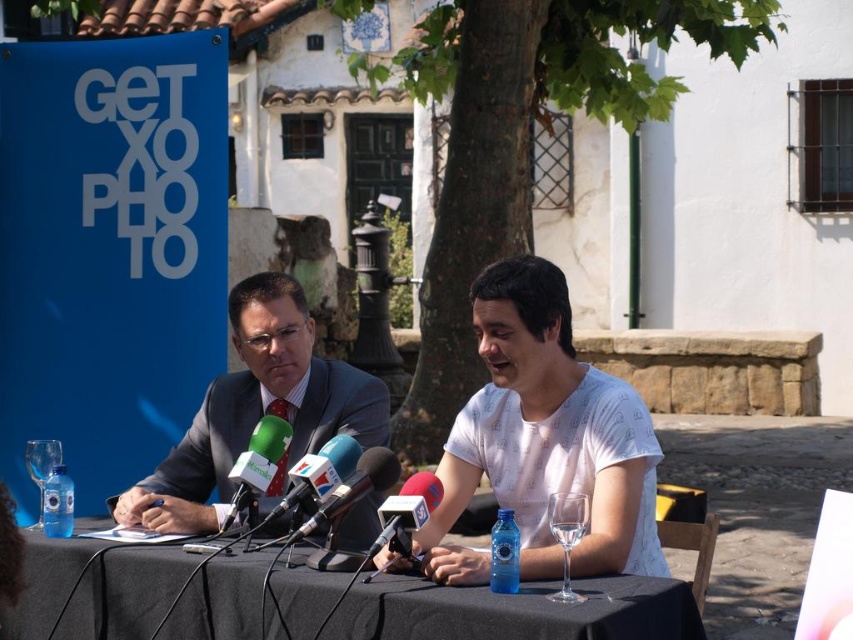
Based on the photo, does black fabric table at center appear on the left side of green plastic microphone at center?

Incorrect, black fabric table at center is not on the left side of green plastic microphone at center.

Can you confirm if black fabric table at center is wider than green plastic microphone at center?

Indeed, black fabric table at center has a greater width compared to green plastic microphone at center.

The height and width of the screenshot is (640, 853). Describe the element at coordinates (517, 611) in the screenshot. I see `black fabric table at center` at that location.

This screenshot has height=640, width=853. Find the location of `black fabric table at center`. black fabric table at center is located at coordinates (517, 611).

Who is lower down, green matte microphone at center or metallic microphones at center?

metallic microphones at center is lower down.

Does green matte microphone at center appear over metallic microphones at center?

Indeed, green matte microphone at center is positioned over metallic microphones at center.

Identify the location of green matte microphone at center. The image size is (853, 640). (257, 467).

What are the coordinates of `green matte microphone at center` in the screenshot? It's located at (257, 467).

Is green plastic microphone at center positioned at the back of metallic microphones at center?

Yes, green plastic microphone at center is behind metallic microphones at center.

Which is more to the right, green plastic microphone at center or metallic microphones at center?

metallic microphones at center is more to the right.

What do you see at coordinates (316, 477) in the screenshot? This screenshot has height=640, width=853. I see `green plastic microphone at center` at bounding box center [316, 477].

Locate an element on the screen. Image resolution: width=853 pixels, height=640 pixels. green plastic microphone at center is located at coordinates (316, 477).